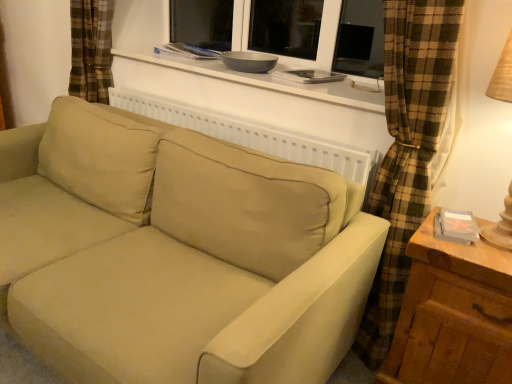
Question: Is the surface of wooden at right in direct contact with white matte window sill at upper center?

Choices:
 (A) no
 (B) yes

Answer: (A)

Question: Is wooden at right thinner than white matte window sill at upper center?

Choices:
 (A) yes
 (B) no

Answer: (A)

Question: From a real-world perspective, is wooden at right on top of white matte window sill at upper center?

Choices:
 (A) no
 (B) yes

Answer: (A)

Question: From the image's perspective, is wooden at right below white matte window sill at upper center?

Choices:
 (A) yes
 (B) no

Answer: (A)

Question: Can you confirm if wooden at right is shorter than white matte window sill at upper center?

Choices:
 (A) no
 (B) yes

Answer: (A)

Question: From a real-world perspective, is white matte window sill at upper center physically located above or below wooden at right?

Choices:
 (A) above
 (B) below

Answer: (A)

Question: Choose the correct answer: Is white matte window sill at upper center inside wooden at right or outside it?

Choices:
 (A) inside
 (B) outside

Answer: (B)

Question: In the image, is white matte window sill at upper center positioned in front of or behind wooden at right?

Choices:
 (A) front
 (B) behind

Answer: (B)

Question: Visually, is white matte window sill at upper center positioned to the left or to the right of wooden at right?

Choices:
 (A) right
 (B) left

Answer: (B)

Question: From the image's perspective, is beige fabric couch at center above or below white matte window sill at upper center?

Choices:
 (A) below
 (B) above

Answer: (A)

Question: Looking at the image, does beige fabric couch at center seem bigger or smaller compared to white matte window sill at upper center?

Choices:
 (A) small
 (B) big

Answer: (B)

Question: Is beige fabric couch at center inside or outside of white matte window sill at upper center?

Choices:
 (A) outside
 (B) inside

Answer: (A)

Question: Is beige fabric couch at center to the left or to the right of white matte window sill at upper center in the image?

Choices:
 (A) right
 (B) left

Answer: (B)

Question: In terms of size, does wooden at right appear bigger or smaller than white matte window sill at upper center?

Choices:
 (A) big
 (B) small

Answer: (A)

Question: Considering the positions of point pyautogui.click(x=494, y=327) and point pyautogui.click(x=357, y=100), is point pyautogui.click(x=494, y=327) closer or farther from the camera than point pyautogui.click(x=357, y=100)?

Choices:
 (A) farther
 (B) closer

Answer: (B)